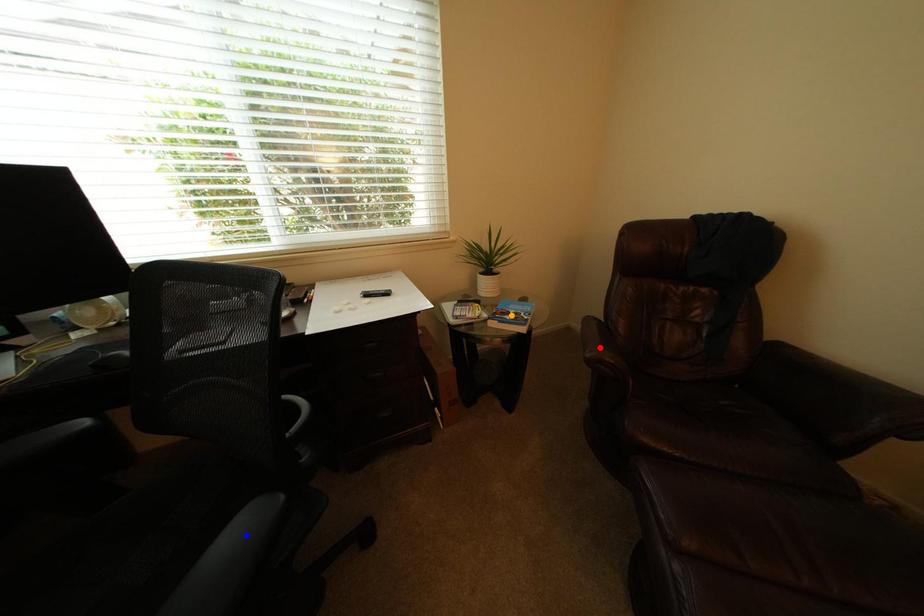
Order these from farthest to nearest:
- red point
- orange point
- blue point

red point
orange point
blue point